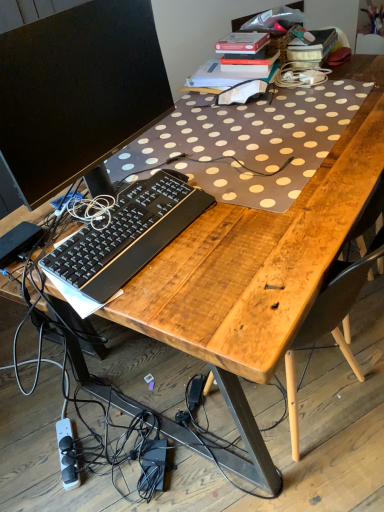
This screenshot has width=384, height=512. In order to click on vacant space to the right of white plastic power strip at lower left in this screenshot , I will do `click(108, 445)`.